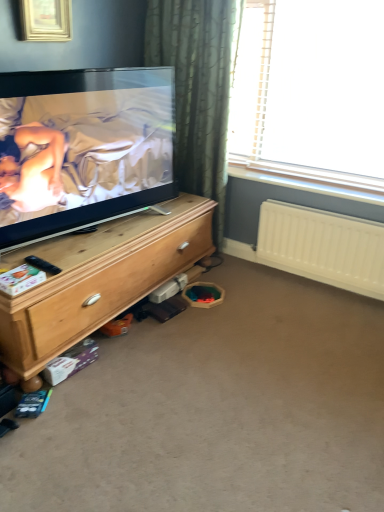
The height and width of the screenshot is (512, 384). I want to click on free spot below white plastic radiator at lower right (from a real-world perspective), so click(x=315, y=281).